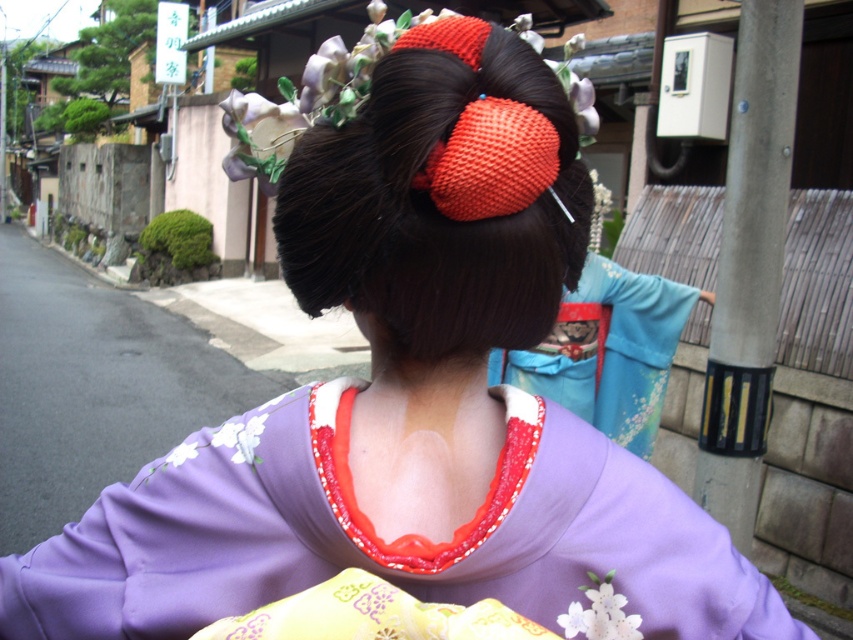
Which of these two, purple satin kimono at center or smooth dark brown hair bun at center, stands shorter?

Standing shorter between the two is purple satin kimono at center.

Is point (775, 593) positioned in front of point (492, 180)?

No, (775, 593) is further to viewer.

Locate an element on the screen. The height and width of the screenshot is (640, 853). purple satin kimono at center is located at coordinates (392, 541).

This screenshot has width=853, height=640. What are the coordinates of `purple satin kimono at center` in the screenshot? It's located at (392, 541).